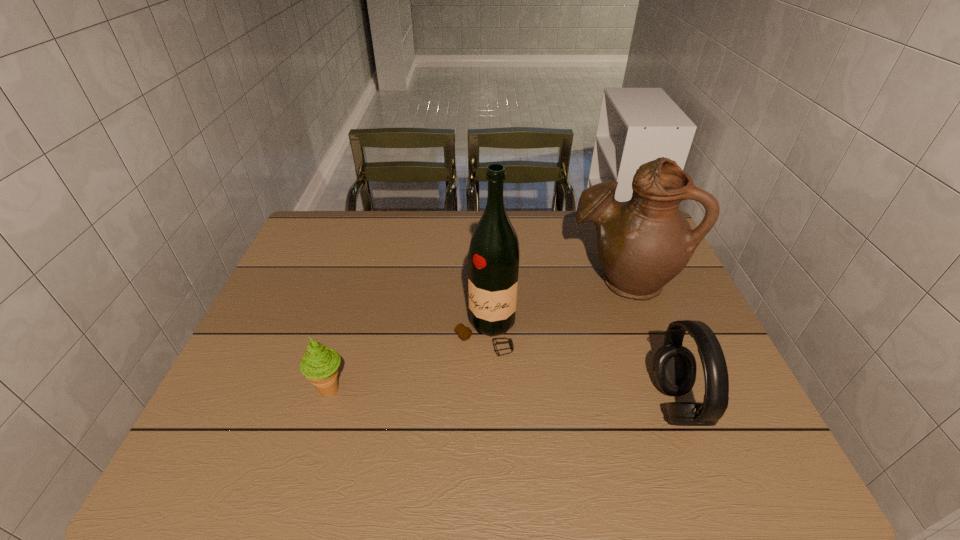
This screenshot has height=540, width=960. Find the location of `vacant space at the far edge of the desktop`. vacant space at the far edge of the desktop is located at coordinates (437, 239).

Where is `free space at the near edge of the desktop`? free space at the near edge of the desktop is located at coordinates (592, 397).

Locate an element on the screen. This screenshot has height=540, width=960. free region at the left edge is located at coordinates (273, 292).

The width and height of the screenshot is (960, 540). In the image, there is a desktop. Identify the location of vacant space at the far left corner. (345, 239).

Locate an element on the screen. This screenshot has height=540, width=960. vacant space in between the headset and the third shortest object is located at coordinates (649, 342).

Locate an element on the screen. vacant area between the third object from right to left and the pitcher is located at coordinates (554, 306).

The image size is (960, 540). Identify the location of vacant area between the shortest object and the third tallest object. (503, 396).

Identify the location of free point between the third tallest object and the leftmost object. (503, 396).

This screenshot has height=540, width=960. I want to click on unoccupied area between the third shortest object and the wine bottle, so click(x=554, y=306).

Identify the location of empty space between the pitcher and the wine bottle. The width and height of the screenshot is (960, 540). (554, 306).